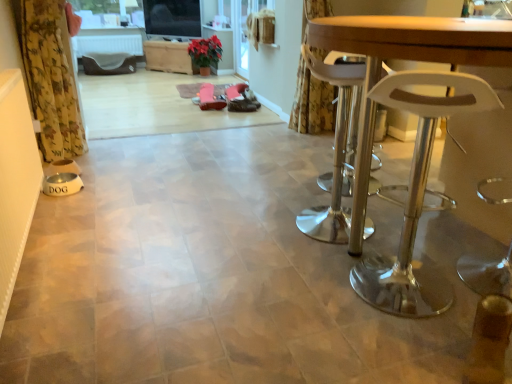
At what (x,y) coordinates should I click in order to perform the action: click on free space that is in between wooden table at right and clear plastic stool at right. Please return your answer as a coordinate pair (x, y). The height and width of the screenshot is (384, 512). Looking at the image, I should click on (328, 287).